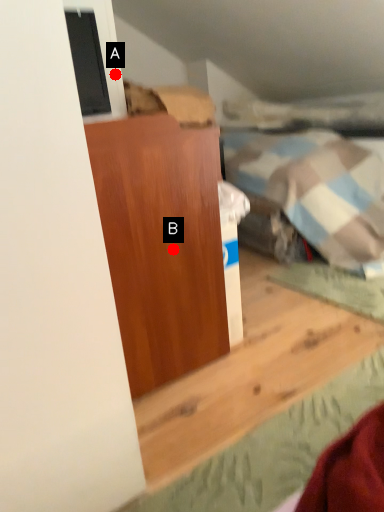
Question: Two points are circled on the image, labeled by A and B beside each circle. Among these points, which one is farthest from the camera?

Choices:
 (A) A is further
 (B) B is further

Answer: (A)